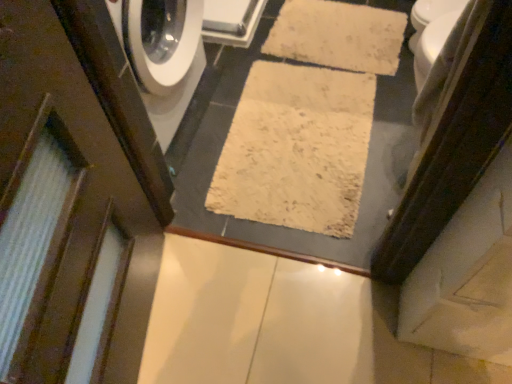
The height and width of the screenshot is (384, 512). In order to click on blank space situated above beige textured bath mat at center (from a real-world perspective) in this screenshot , I will do `click(307, 129)`.